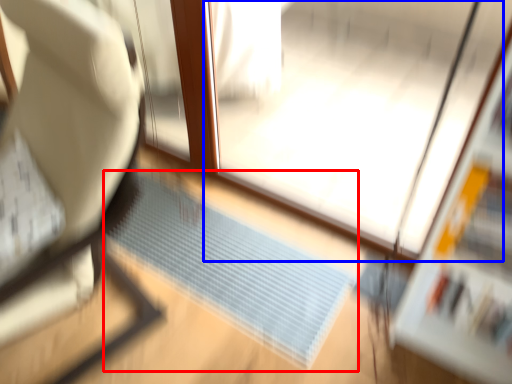
Question: Which object is closer to the camera taking this photo, doormat (highlighted by a red box) or screen door (highlighted by a blue box)?

Choices:
 (A) doormat
 (B) screen door

Answer: (B)